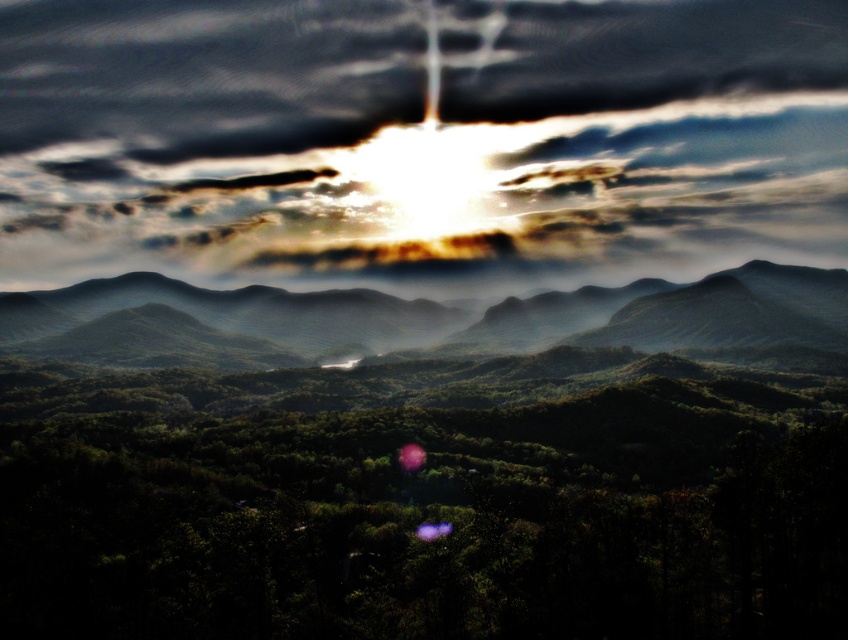
Question: Does cloudy sky at upper center appear on the left side of smooth green mountains at center?

Choices:
 (A) yes
 (B) no

Answer: (B)

Question: Which point is farther to the camera?

Choices:
 (A) cloudy sky at upper center
 (B) smooth green mountains at center

Answer: (A)

Question: Observing the image, what is the correct spatial positioning of cloudy sky at upper center in reference to smooth green mountains at center?

Choices:
 (A) above
 (B) below

Answer: (A)

Question: Which point is closer to the camera taking this photo?

Choices:
 (A) (142, 337)
 (B) (276, 241)

Answer: (A)

Question: Can you confirm if cloudy sky at upper center is positioned below smooth green mountains at center?

Choices:
 (A) yes
 (B) no

Answer: (B)